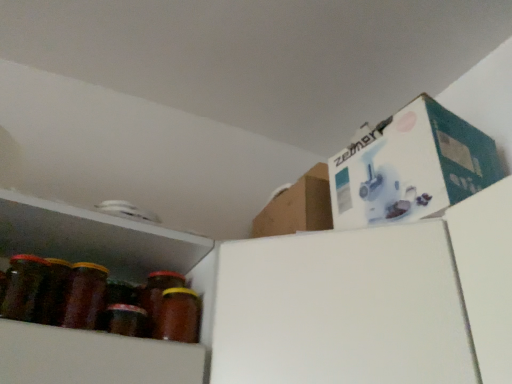
Question: From their relative heights in the image, would you say brown glass jar at lower left, acting as the first bottle starting from the right, is taller or shorter than shiny brown glass jar at left, which is the 2th bottle in right-to-left order?

Choices:
 (A) short
 (B) tall

Answer: (A)

Question: From the image's perspective, is brown glass jar at lower left, the 2th bottle positioned from the left, located above or below shiny brown glass jar at left, which is the 2th bottle in right-to-left order?

Choices:
 (A) below
 (B) above

Answer: (A)

Question: In terms of size, does brown glass jar at lower left, acting as the first bottle starting from the right, appear bigger or smaller than shiny brown glass jar at left, which is the 2th bottle in right-to-left order?

Choices:
 (A) small
 (B) big

Answer: (A)

Question: Relative to brown glass jar at lower left, acting as the first bottle starting from the right, is shiny brown glass jar at left, which is the 2th bottle in right-to-left order, in front or behind?

Choices:
 (A) behind
 (B) front

Answer: (B)

Question: In the image, is shiny brown glass jar at left, marked as the 1th bottle in a left-to-right arrangement, on the left side or the right side of brown glass jar at lower left, the 2th bottle positioned from the left?

Choices:
 (A) right
 (B) left

Answer: (B)

Question: Is shiny brown glass jar at left, marked as the 1th bottle in a left-to-right arrangement, inside the boundaries of brown glass jar at lower left, the 2th bottle positioned from the left, or outside?

Choices:
 (A) outside
 (B) inside

Answer: (A)

Question: From the image's perspective, is shiny brown glass jar at left, marked as the 1th bottle in a left-to-right arrangement, positioned above or below brown glass jar at lower left, acting as the first bottle starting from the right?

Choices:
 (A) below
 (B) above

Answer: (B)